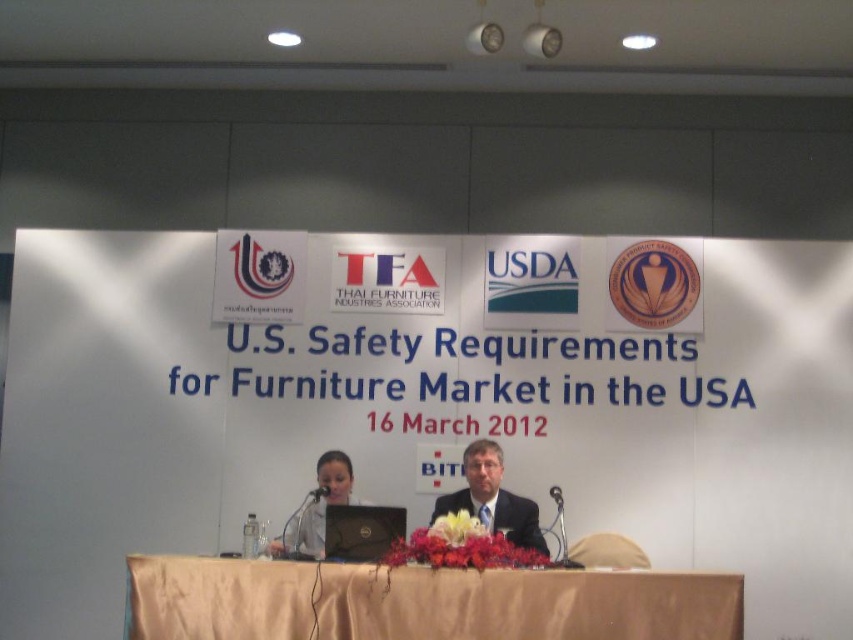
Question: Which point appears farthest from the camera in this image?

Choices:
 (A) (323, 548)
 (B) (686, 605)

Answer: (A)

Question: Does dark suit at center lie in front of black matte laptop at center?

Choices:
 (A) no
 (B) yes

Answer: (A)

Question: Is gold satin table at center further to camera compared to dark suit at center?

Choices:
 (A) no
 (B) yes

Answer: (A)

Question: Which object is positioned farthest from the dark suit at center?

Choices:
 (A) black matte laptop at center
 (B) gold satin table at center

Answer: (B)

Question: Which point appears farthest from the camera in this image?

Choices:
 (A) (372, 528)
 (B) (463, 490)
 (C) (724, 600)

Answer: (B)

Question: Can you confirm if gold satin table at center is thinner than dark suit at center?

Choices:
 (A) no
 (B) yes

Answer: (A)